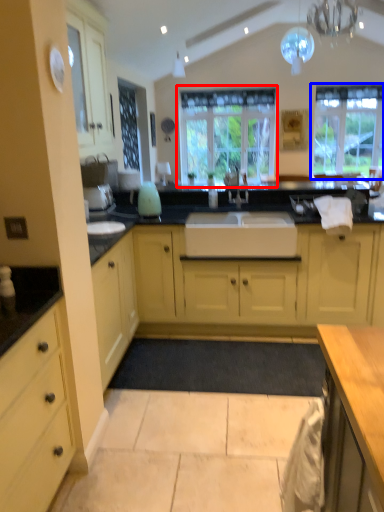
Question: Which of the following is the closest to the observer, window (highlighted by a red box) or window (highlighted by a blue box)?

Choices:
 (A) window
 (B) window

Answer: (B)